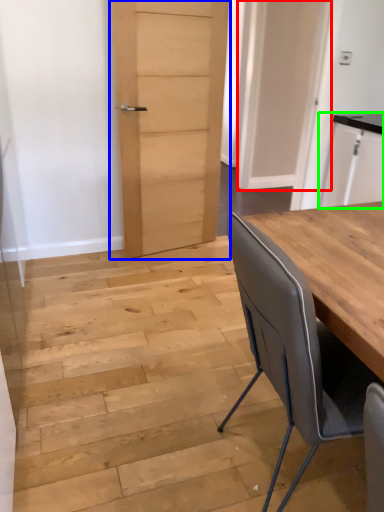
Question: Which is nearer to the door (highlighted by a red box)? door (highlighted by a blue box) or cabinetry (highlighted by a green box).

Choices:
 (A) door
 (B) cabinetry

Answer: (B)